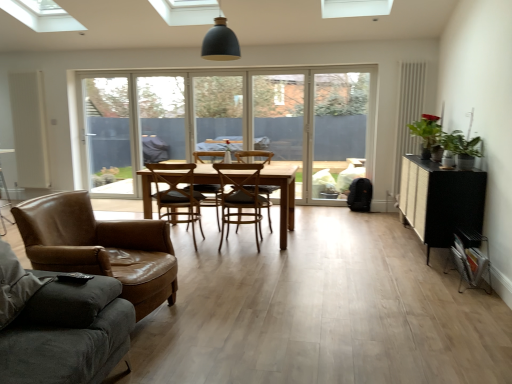
Question: From the image's perspective, would you say light brown wooden table at center is positioned over wooden chair at center, which appears as the 2th chair when viewed from the front?

Choices:
 (A) no
 (B) yes

Answer: (A)

Question: Can you confirm if light brown wooden table at center is wider than wooden chair at center, which appears as the 2th chair when viewed from the front?

Choices:
 (A) yes
 (B) no

Answer: (A)

Question: From a real-world perspective, is light brown wooden table at center located beneath wooden chair at center, arranged as the 3th chair when viewed from the back?

Choices:
 (A) no
 (B) yes

Answer: (B)

Question: Does light brown wooden table at center have a greater height compared to wooden chair at center, which appears as the 2th chair when viewed from the front?

Choices:
 (A) no
 (B) yes

Answer: (A)

Question: Considering the relative sizes of light brown wooden table at center and wooden chair at center, arranged as the 3th chair when viewed from the back, in the image provided, is light brown wooden table at center thinner than wooden chair at center, arranged as the 3th chair when viewed from the back,?

Choices:
 (A) no
 (B) yes

Answer: (A)

Question: Do you think transparent glass door at center is within dark gray fabric studio couch at lower left, or outside of it?

Choices:
 (A) inside
 (B) outside

Answer: (B)

Question: In terms of width, does transparent glass door at center look wider or thinner when compared to dark gray fabric studio couch at lower left?

Choices:
 (A) thin
 (B) wide

Answer: (A)

Question: Visually, is transparent glass door at center positioned to the left or to the right of dark gray fabric studio couch at lower left?

Choices:
 (A) right
 (B) left

Answer: (A)

Question: From a real-world perspective, is transparent glass door at center above or below dark gray fabric studio couch at lower left?

Choices:
 (A) above
 (B) below

Answer: (A)

Question: Is dark gray fabric studio couch at lower left in front of or behind brown leather chair at center, arranged as the 3th chair when viewed from the front, in the image?

Choices:
 (A) behind
 (B) front

Answer: (B)

Question: Considering the positions of dark gray fabric studio couch at lower left and brown leather chair at center, placed as the second chair when sorted from back to front, in the image, is dark gray fabric studio couch at lower left bigger or smaller than brown leather chair at center, placed as the second chair when sorted from back to front,?

Choices:
 (A) small
 (B) big

Answer: (B)

Question: Is dark gray fabric studio couch at lower left taller or shorter than brown leather chair at center, arranged as the 3th chair when viewed from the front?

Choices:
 (A) tall
 (B) short

Answer: (A)

Question: Based on their positions, is dark gray fabric studio couch at lower left located to the left or right of brown leather chair at center, arranged as the 3th chair when viewed from the front?

Choices:
 (A) left
 (B) right

Answer: (A)

Question: Based on their positions, is transparent glass door at left located to the left or right of brown leather armchair at center?

Choices:
 (A) right
 (B) left

Answer: (B)

Question: Is point (96, 94) positioned closer to the camera than point (265, 206)?

Choices:
 (A) farther
 (B) closer

Answer: (A)